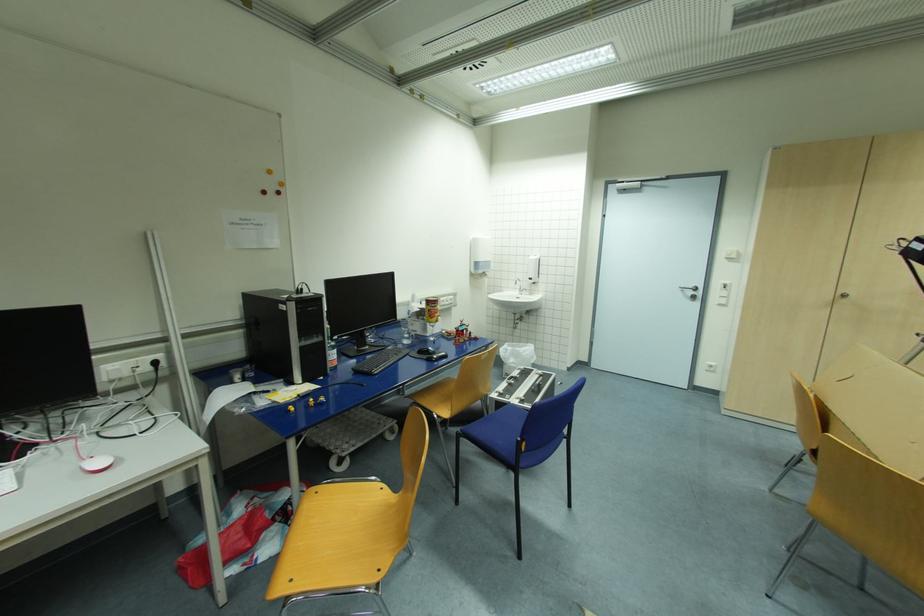
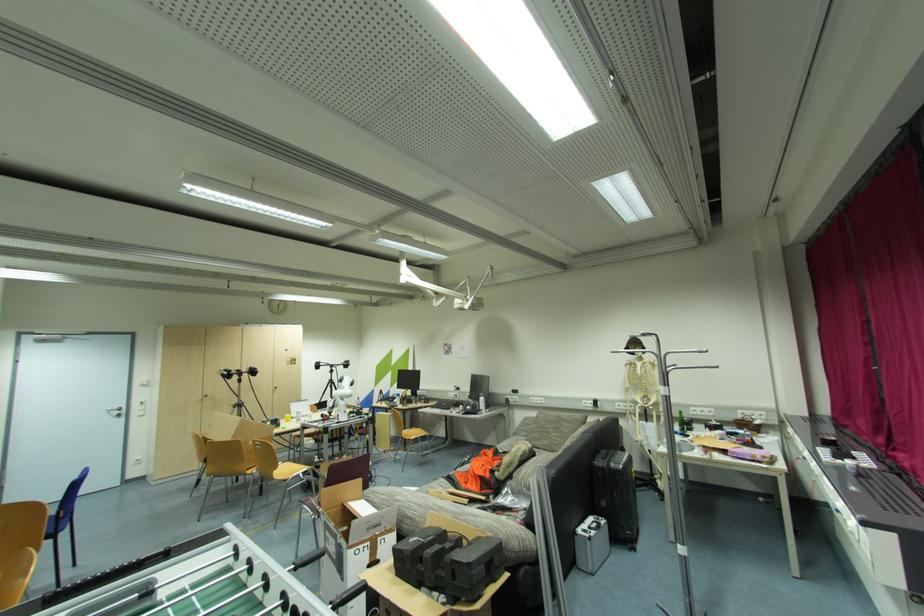
The point at (696, 293) is marked in the first image. Where is the corresponding point in the second image?

(122, 413)